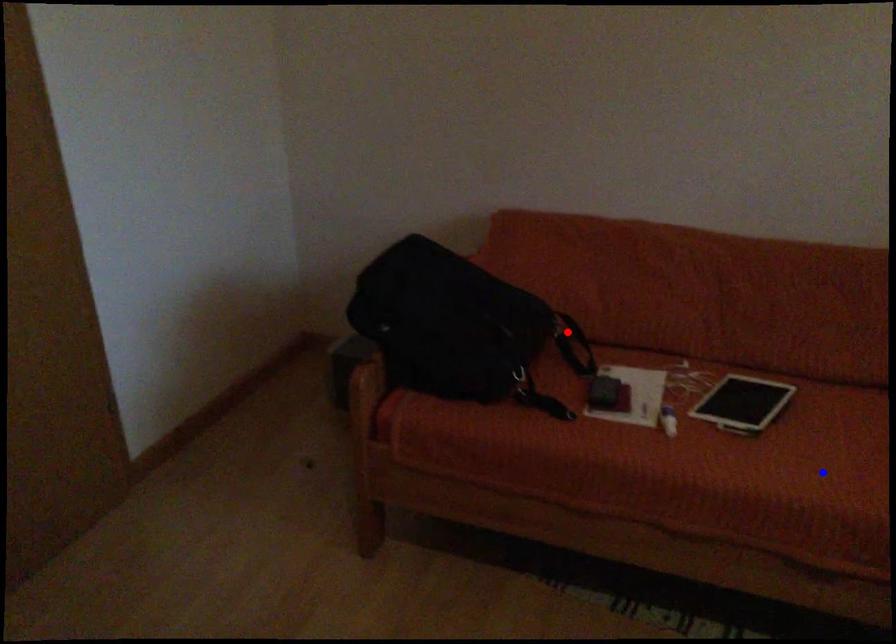
Question: Which of the two points in the image is closer to the camera?

Choices:
 (A) Blue point is closer.
 (B) Red point is closer.

Answer: (A)